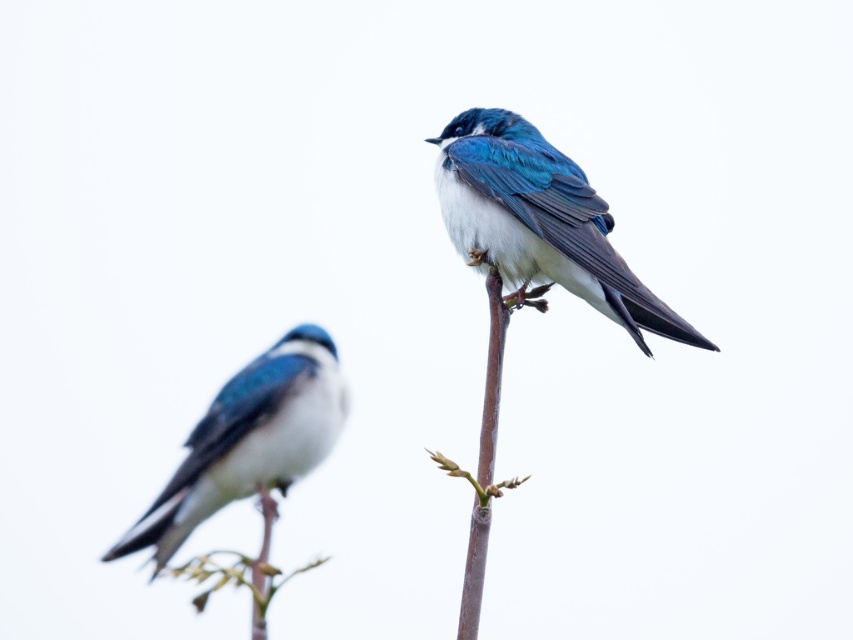
Question: Can you confirm if shiny blue bird at center is thinner than green leafy branch at lower left?

Choices:
 (A) no
 (B) yes

Answer: (A)

Question: Which is farther from the shiny blue bird at center?

Choices:
 (A) green leafy branch at lower left
 (B) white matte bird at center

Answer: (A)

Question: Does white matte bird at center have a greater width compared to green leafy branch at lower left?

Choices:
 (A) yes
 (B) no

Answer: (A)

Question: Which of the following is the farthest from the observer?

Choices:
 (A) green leafy branch at lower left
 (B) shiny blue bird at center
 (C) white matte bird at center

Answer: (C)

Question: Is shiny blue bird at center above green leafy branch at lower left?

Choices:
 (A) no
 (B) yes

Answer: (B)

Question: Among these points, which one is nearest to the camera?

Choices:
 (A) (279, 572)
 (B) (521, 240)

Answer: (A)